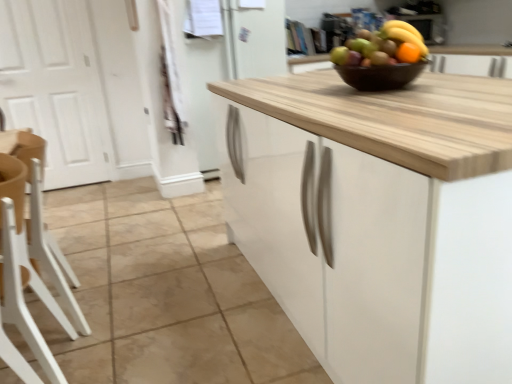
The image size is (512, 384). I want to click on free point to the right of white plastic chair at lower left, the 2th chair positioned from the back, so click(x=133, y=355).